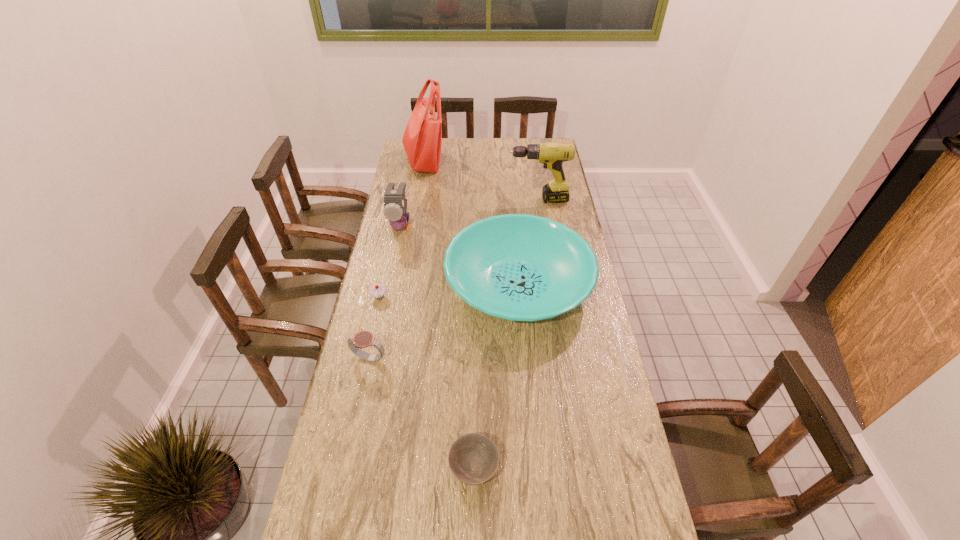
Where is `free space in the image that satisfies the following two spatial constraints: 1. on the front side of the cupcake; 2. on the right side of the nearest object`? free space in the image that satisfies the following two spatial constraints: 1. on the front side of the cupcake; 2. on the right side of the nearest object is located at coordinates (342, 470).

At what (x,y) coordinates should I click in order to perform the action: click on free spot that satisfies the following two spatial constraints: 1. on the front-facing side of the tallest object; 2. on the back side of the fourth tallest object. Please return your answer as a coordinate pair (x, y). Looking at the image, I should click on (402, 285).